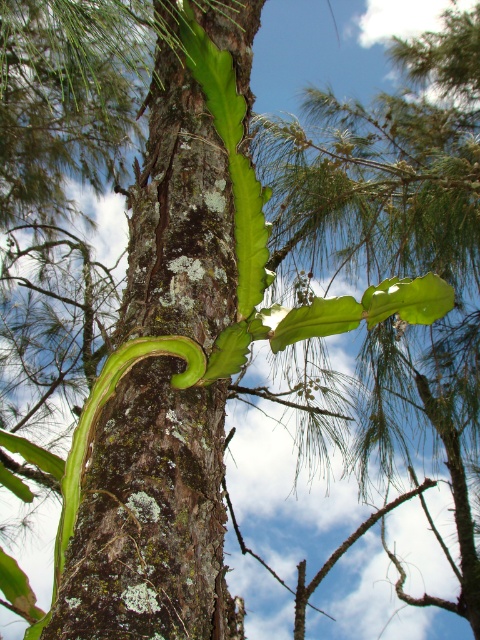
Question: Which point is farther from the camera taking this photo?

Choices:
 (A) (146, 346)
 (B) (182, 81)

Answer: (B)

Question: Does green rough bark tree trunk at center come behind green leafy plant at center?

Choices:
 (A) yes
 (B) no

Answer: (B)

Question: Does green rough bark tree trunk at center have a larger size compared to green leafy plant at center?

Choices:
 (A) yes
 (B) no

Answer: (A)

Question: Is green rough bark tree trunk at center thinner than green leafy plant at center?

Choices:
 (A) no
 (B) yes

Answer: (A)

Question: Which object is closer to the camera taking this photo?

Choices:
 (A) green leafy plant at center
 (B) green rough bark tree trunk at center

Answer: (B)